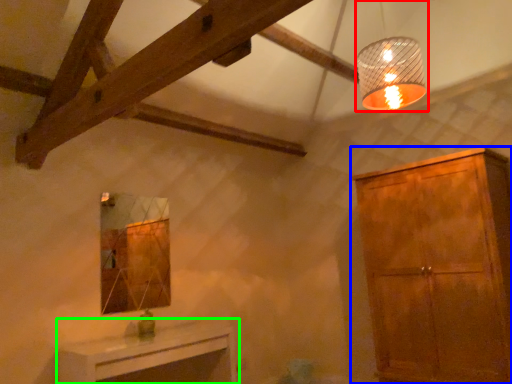
Question: Considering the real-world distances, which object is farthest from lamp (highlighted by a red box)? cabinetry (highlighted by a blue box) or table (highlighted by a green box)?

Choices:
 (A) cabinetry
 (B) table

Answer: (B)